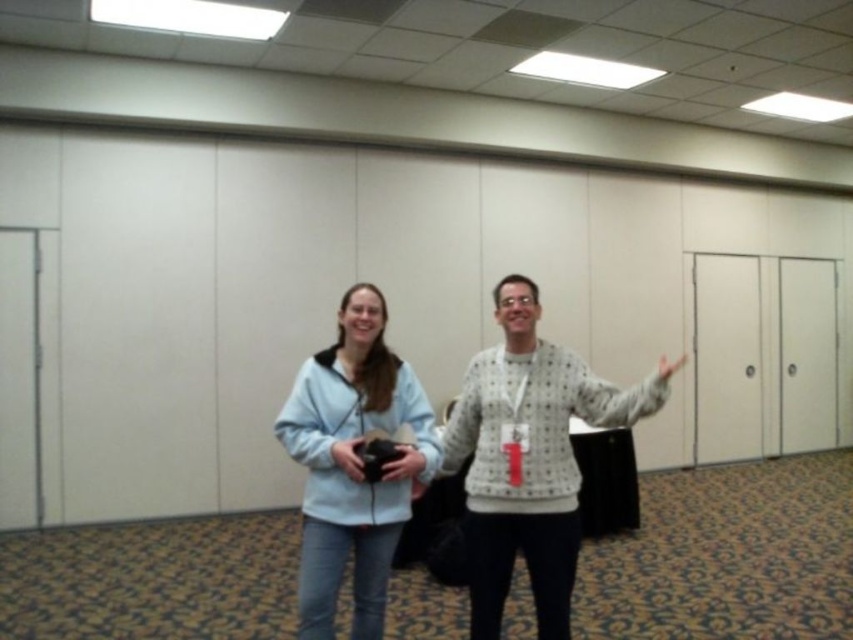
Does white dotted sweater at center have a greater height compared to matte gray hand at right?

Indeed, white dotted sweater at center has a greater height compared to matte gray hand at right.

Is white dotted sweater at center behind matte gray hand at right?

That is False.

What do you see at coordinates (527, 460) in the screenshot?
I see `white dotted sweater at center` at bounding box center [527, 460].

This screenshot has width=853, height=640. I want to click on white dotted sweater at center, so click(x=527, y=460).

Who is more distant from viewer, (640, 384) or (380, 522)?

The point (640, 384) is behind.

This screenshot has height=640, width=853. Describe the element at coordinates (527, 460) in the screenshot. I see `white dotted sweater at center` at that location.

Between point (488, 486) and point (363, 576), which one is positioned in front?

Point (488, 486)

The image size is (853, 640). Find the location of `white dotted sweater at center`. white dotted sweater at center is located at coordinates (527, 460).

Can you confirm if light blue fleece at center is smaller than matte gray sweater at center?

Actually, light blue fleece at center might be larger than matte gray sweater at center.

Can you confirm if light blue fleece at center is bigger than matte gray sweater at center?

Yes, light blue fleece at center is bigger than matte gray sweater at center.

Which is in front, point (370, 289) or point (392, 477)?

Point (392, 477) is in front.

Locate an element on the screen. light blue fleece at center is located at coordinates [344, 472].